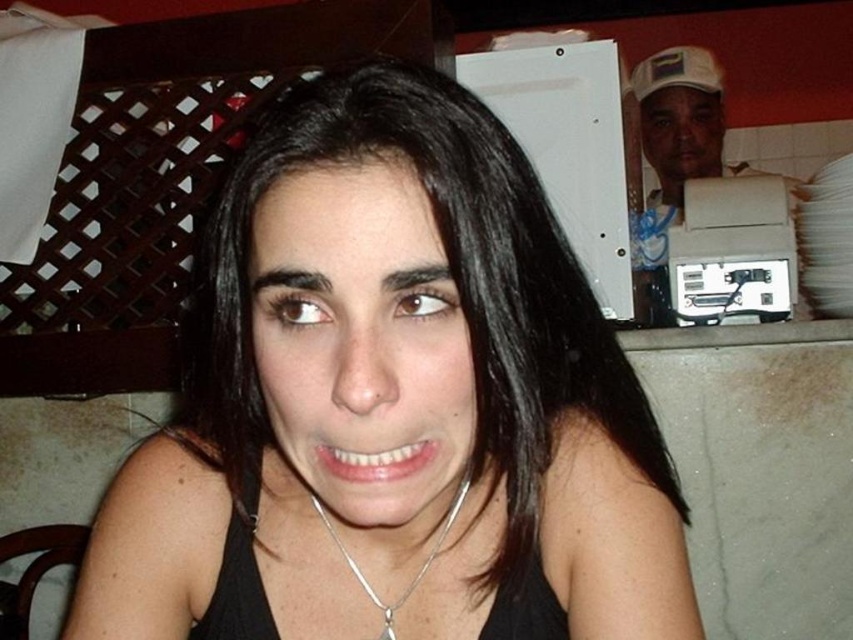
Who is lower down, black matte tank top at center or silver chain at center?

silver chain at center

Is black matte tank top at center smaller than silver chain at center?

Actually, black matte tank top at center might be larger than silver chain at center.

Find the location of `black matte tank top at center`. black matte tank top at center is located at coordinates (392, 404).

Locate an element on the screen. Image resolution: width=853 pixels, height=640 pixels. black matte tank top at center is located at coordinates click(x=392, y=404).

Is black matte tank top at center closer to camera compared to white paper towel at upper right?

Yes, black matte tank top at center is in front of white paper towel at upper right.

Can you confirm if black matte tank top at center is shorter than white paper towel at upper right?

Indeed, black matte tank top at center has a lesser height compared to white paper towel at upper right.

The height and width of the screenshot is (640, 853). In order to click on black matte tank top at center in this screenshot , I will do `click(392, 404)`.

Does white paper towel at upper right come behind silver chain at center?

Yes, it is.

Between point (637, 77) and point (401, 600), which one is positioned behind?

The point (637, 77) is more distant.

You are a GUI agent. You are given a task and a screenshot of the screen. Output one action in this format:
    pyautogui.click(x=<x>, y=<y>)
    Task: Click on the white paper towel at upper right
    The width and height of the screenshot is (853, 640).
    Given the screenshot: What is the action you would take?
    pyautogui.click(x=682, y=120)